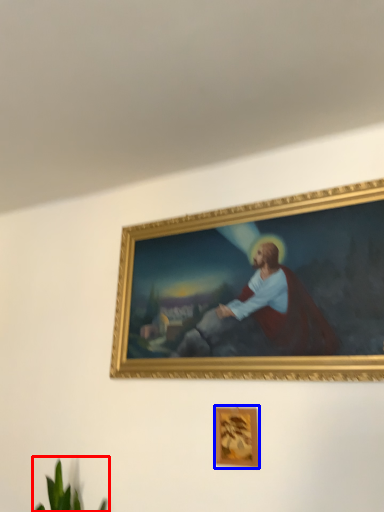
Question: Which point is further to the camera, plant (highlighted by a red box) or picture frame (highlighted by a blue box)?

Choices:
 (A) plant
 (B) picture frame

Answer: (B)